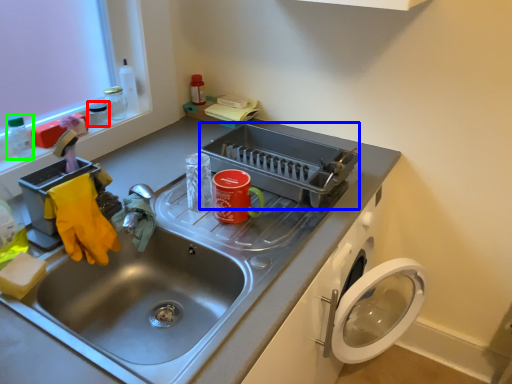
Question: Based on their relative distances, which object is nearer to appliance (highlighted by a red box)? Choose from appliance (highlighted by a blue box) and bottle (highlighted by a green box).

Choices:
 (A) appliance
 (B) bottle

Answer: (B)